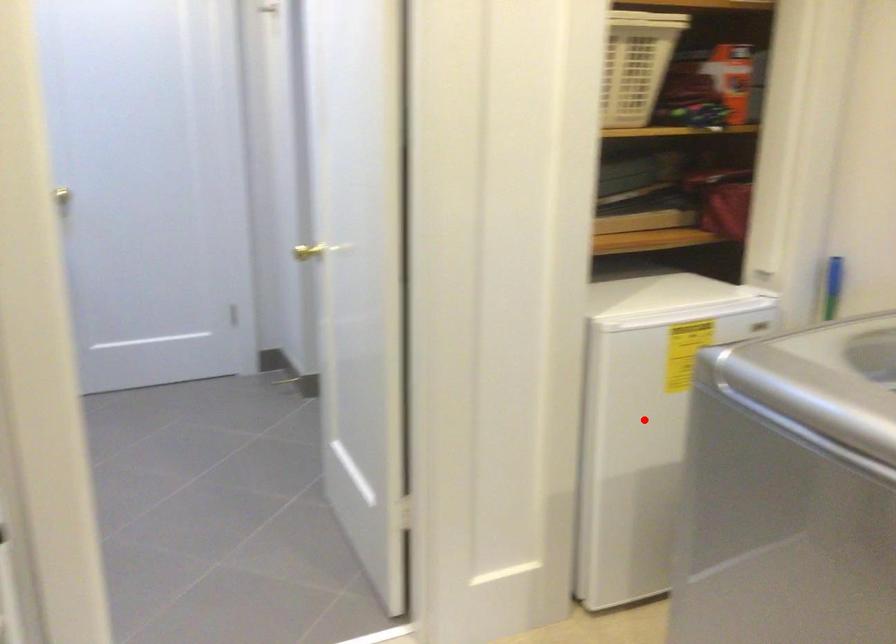
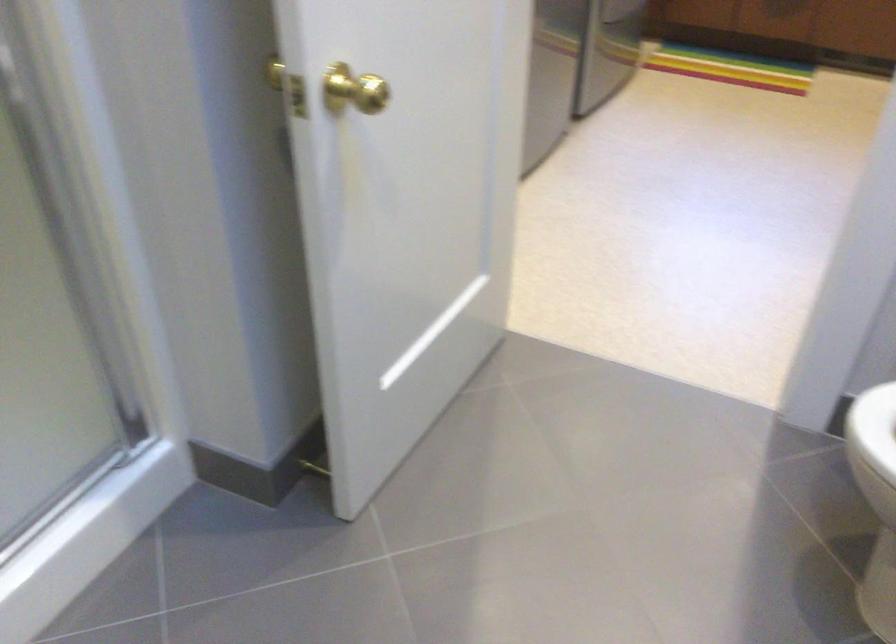
Question: I am providing you with two images of the same scene from different viewpoints. A red point is marked on the first image. Is the red point's position out of view in image 2?

Choices:
 (A) Yes
 (B) No

Answer: (A)